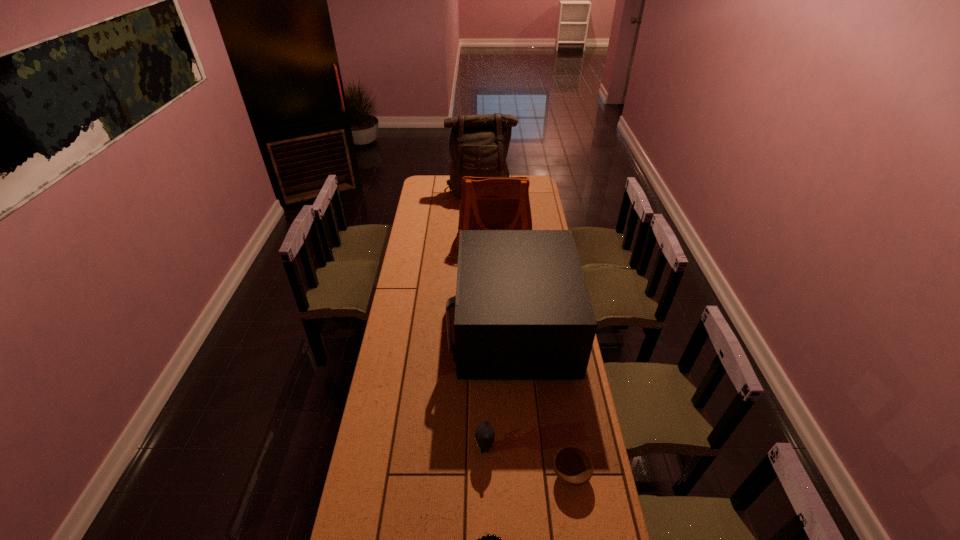
Find the location of a particular element. bowl that is at the right edge is located at coordinates (573, 467).

This screenshot has height=540, width=960. What are the coordinates of `vacant space at the left edge of the desktop` in the screenshot? It's located at (394, 433).

Locate an element on the screen. The height and width of the screenshot is (540, 960). vacant space at the right edge of the desktop is located at coordinates (583, 495).

Find the location of a particular element. free space at the far left corner of the desktop is located at coordinates click(x=419, y=190).

The width and height of the screenshot is (960, 540). Identify the location of blank region between the fifth tallest object and the microwave oven. (541, 401).

What are the coordinates of `the fifth closest object to the bowl` in the screenshot? It's located at (478, 146).

Select which object is the closest to the bowl. Please provide its 2D coordinates. Your answer should be formatted as a tuple, i.e. [(x, y)], where the tuple contains the x and y coordinates of a point satisfying the conditions above.

[(484, 434)]

Identify the location of free space that satisfies the following two spatial constraints: 1. on the front pocket of the fifth nearest object; 2. on the front-facing side of the kitten. This screenshot has height=540, width=960. pos(503,448).

Locate an element on the screen. Image resolution: width=960 pixels, height=540 pixels. blank space that satisfies the following two spatial constraints: 1. on the front pocket of the second farthest object; 2. on the front-facing side of the kitten is located at coordinates (503, 448).

Find the location of `free location that satisfies the following two spatial constraints: 1. on the front pocket of the second shortest object; 2. on the left side of the second tallest object`. free location that satisfies the following two spatial constraints: 1. on the front pocket of the second shortest object; 2. on the left side of the second tallest object is located at coordinates [x=504, y=475].